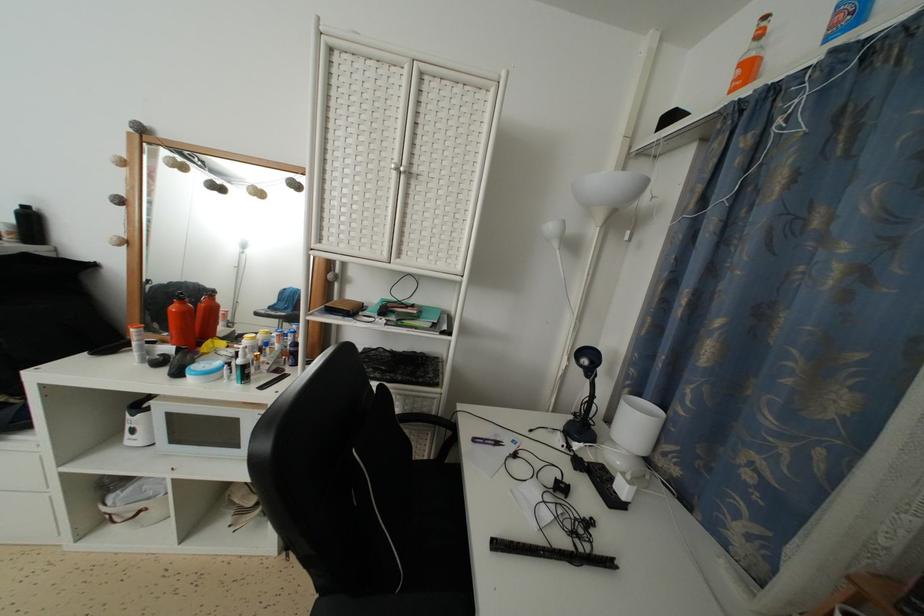
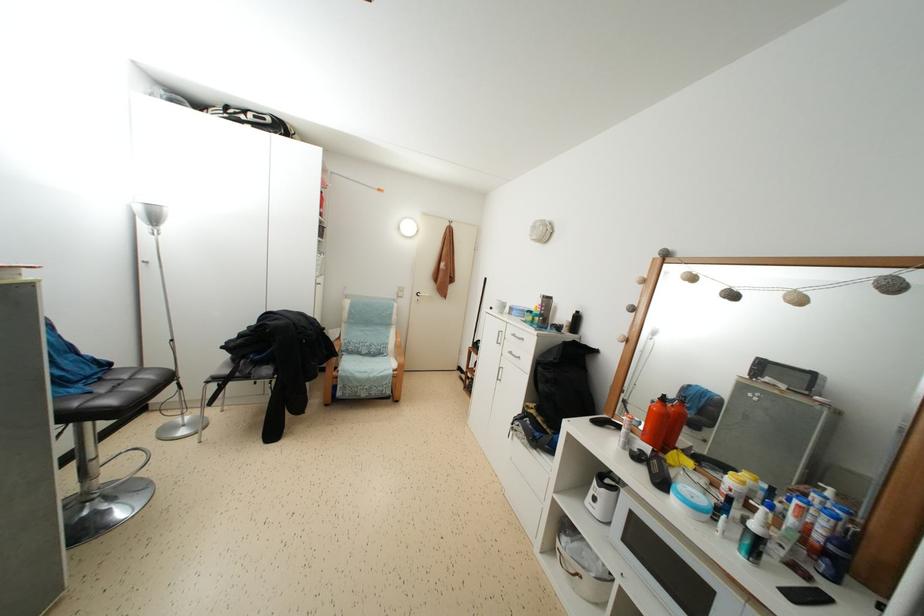
Locate, in the second image, the point that corresponds to point 248,373 in the first image.

(763, 546)